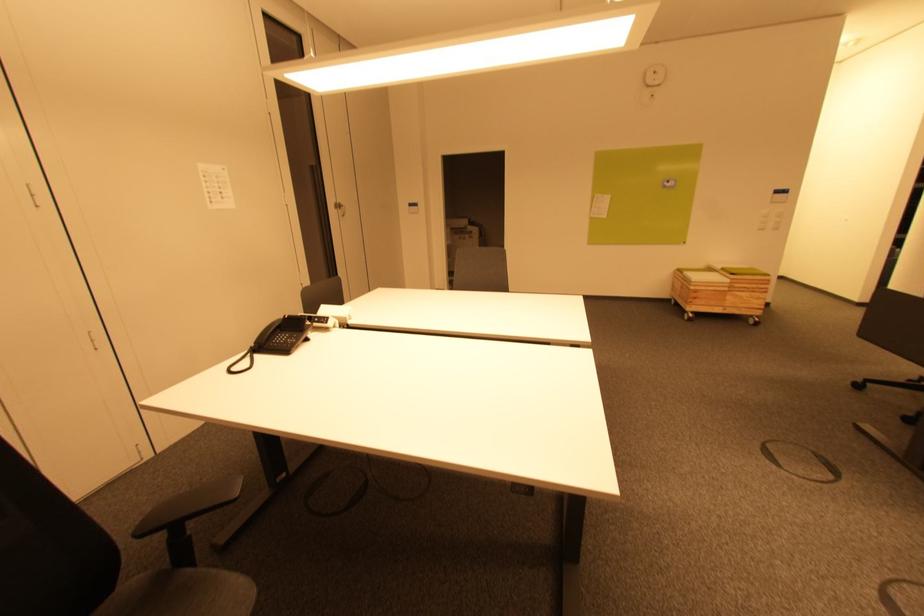
Find where to sit the chair sitting surface. Please return your answer as a coordinate pair (x, y).

(208, 593)